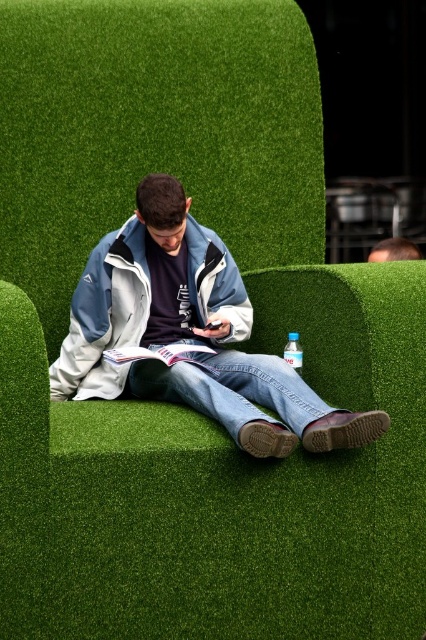
This screenshot has height=640, width=426. What do you see at coordinates (161, 355) in the screenshot?
I see `striped fabric book at center` at bounding box center [161, 355].

Does striped fabric book at center appear over clear plastic bottle at center?

Incorrect, striped fabric book at center is not positioned above clear plastic bottle at center.

This screenshot has width=426, height=640. Identify the location of striped fabric book at center. (161, 355).

Image resolution: width=426 pixels, height=640 pixels. Identify the location of striped fabric book at center. (161, 355).

Can you confirm if striped fabric book at center is shorter than smooth brown hair at upper right?

Indeed, striped fabric book at center has a lesser height compared to smooth brown hair at upper right.

Which of these two, striped fabric book at center or smooth brown hair at upper right, stands shorter?

striped fabric book at center

Measure the distance between striped fabric book at center and camera.

A distance of 14.74 feet exists between striped fabric book at center and camera.

Identify the location of striped fabric book at center. The height and width of the screenshot is (640, 426). (161, 355).

Which of these two, light blue jacket at center or clear plastic bottle at center, stands shorter?

With less height is clear plastic bottle at center.

Identify the location of light blue jacket at center. The width and height of the screenshot is (426, 640). (189, 333).

Does point (81, 388) lie behind point (301, 362)?

Yes, it is.

In order to click on light blue jacket at center in this screenshot , I will do `click(189, 333)`.